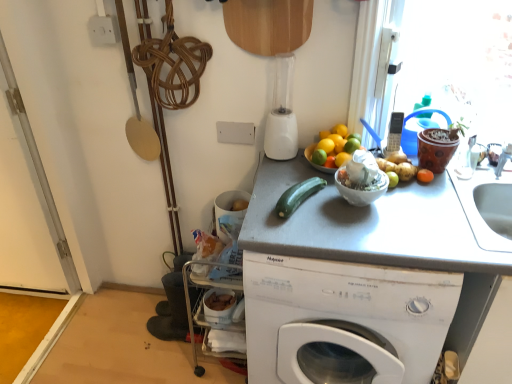
Measure the distance between point (324, 285) and camera.

Point (324, 285) and camera are 1.17 meters apart.

What is the approximate height of white plastic blender at upper center?

13.74 inches.

Identify the location of yellow matte orange at center, the 1th orange in the bottom-to-top sequence. Image resolution: width=512 pixels, height=384 pixels. (342, 158).

Measure the distance between green matte lime at center, positioned as the 1th lime in left-to-right order, and camera.

A distance of 4.72 feet exists between green matte lime at center, positioned as the 1th lime in left-to-right order, and camera.

What do you see at coordinates (361, 188) in the screenshot?
I see `white glossy bowl at center` at bounding box center [361, 188].

Locate an element on the screen. This screenshot has height=384, width=512. gray matte counter top at center is located at coordinates (366, 224).

The image size is (512, 384). What do you see at coordinates (366, 224) in the screenshot?
I see `gray matte counter top at center` at bounding box center [366, 224].

Where is `white matte washing machine at center`? This screenshot has width=512, height=384. white matte washing machine at center is located at coordinates (344, 320).

Is point (420, 176) in front of point (346, 142)?

Yes, point (420, 176) is closer to viewer.

Between orange matte at right and green matte lime at upper right, the 1th lime in the right-to-left sequence, which one appears on the left side from the viewer's perspective?

green matte lime at upper right, the 1th lime in the right-to-left sequence.

Which of these two, orange matte at right or green matte lime at upper right, which is the second lime from left to right, stands taller?

With more height is green matte lime at upper right, which is the second lime from left to right.

Is orange matte at right completely or partially outside of green matte lime at upper right, the 1th lime in the right-to-left sequence?

orange matte at right is positioned outside green matte lime at upper right, the 1th lime in the right-to-left sequence.

Is orange matte at upper right, which is the second orange from bottom to top, looking in the opposite direction of white plastic phone at upper right?

No, orange matte at upper right, which is the second orange from bottom to top, is not facing away from white plastic phone at upper right.

From the image's perspective, is orange matte at upper right, the 2th orange viewed from the top, positioned above or below white plastic phone at upper right?

Clearly, from the image's perspective, orange matte at upper right, the 2th orange viewed from the top, is below white plastic phone at upper right.

Considering the points (331, 137) and (398, 114), which point is behind, point (331, 137) or point (398, 114)?

The point (398, 114) is more distant.

From the picture: Is orange matte at upper right, which is the second orange from bottom to top, bigger than white plastic phone at upper right?

No, orange matte at upper right, which is the second orange from bottom to top, is not bigger than white plastic phone at upper right.

Are white plastic blender at upper center and orange matte at upper right, which is the second orange from bottom to top, making contact?

They are not placed beside each other.

Is white plastic blender at upper center inside or outside of orange matte at upper right, the 2th orange viewed from the top?

white plastic blender at upper center exists outside the volume of orange matte at upper right, the 2th orange viewed from the top.

Consider the image. How different are the orientations of white plastic blender at upper center and orange matte at upper right, which is the second orange from bottom to top, in degrees?

0.878 degrees separate the facing orientations of white plastic blender at upper center and orange matte at upper right, which is the second orange from bottom to top.

Considering the sizes of white plastic blender at upper center and orange matte at upper right, the 2th orange viewed from the top, in the image, is white plastic blender at upper center bigger or smaller than orange matte at upper right, the 2th orange viewed from the top,?

In the image, white plastic blender at upper center appears to be larger than orange matte at upper right, the 2th orange viewed from the top.

Which of these two, green matte lime at center, positioned as the 1th lime in left-to-right order, or white matte washing machine at center, is thinner?

green matte lime at center, positioned as the 1th lime in left-to-right order, is thinner.

Is green matte lime at center, placed as the second lime when sorted from right to left, to the right of white matte washing machine at center from the viewer's perspective?

Result: No.

Considering the positions of objects green matte lime at center, placed as the second lime when sorted from right to left, and white matte washing machine at center in the image provided, who is behind, green matte lime at center, placed as the second lime when sorted from right to left, or white matte washing machine at center?

green matte lime at center, placed as the second lime when sorted from right to left, is behind.

Is green matte lime at center, positioned as the 1th lime in left-to-right order, not inside white matte washing machine at center?

Yes, green matte lime at center, positioned as the 1th lime in left-to-right order, is located beyond the bounds of white matte washing machine at center.

Is white plastic blender at upper center surrounding orange matte at upper center, marked as the third orange in a bottom-to-top arrangement?

No, orange matte at upper center, marked as the third orange in a bottom-to-top arrangement, is not inside white plastic blender at upper center.

Considering the points (283, 101) and (326, 140), which point is in front, point (283, 101) or point (326, 140)?

The point (326, 140) is in front.

At what (x,y) coordinates should I click in order to perform the action: click on blender on the left of the orange matte at upper center, which is counted as the 1th orange, starting from the top. Please return your answer as a coordinate pair (x, y). The height and width of the screenshot is (384, 512). Looking at the image, I should click on (282, 113).

Considering the relative positions of white plastic blender at upper center and orange matte at upper center, which is counted as the 1th orange, starting from the top, in the image provided, is white plastic blender at upper center to the left of orange matte at upper center, which is counted as the 1th orange, starting from the top, from the viewer's perspective?

Yes.

Does white plastic phone at upper right have a greater width compared to green matte lime at upper right, which is the second lime from left to right?

Correct, the width of white plastic phone at upper right exceeds that of green matte lime at upper right, which is the second lime from left to right.

From the image's perspective, between white plastic phone at upper right and green matte lime at upper right, the 1th lime in the right-to-left sequence, who is located below?

green matte lime at upper right, the 1th lime in the right-to-left sequence, from the image's perspective.

Measure the distance between white plastic phone at upper right and green matte lime at upper right, which is the second lime from left to right.

6.40 inches.

Is green matte lime at upper right, the 1th lime in the right-to-left sequence, at the back of white plastic phone at upper right?

No.

From the image's perspective, which is below, white matte washing machine at center or orange matte at upper right, the 2th orange viewed from the top?

white matte washing machine at center appears lower in the image.

In order to click on the 3rd orange behind the white matte washing machine at center in this screenshot , I will do `click(337, 142)`.

Is white matte washing machine at center spatially inside orange matte at upper right, which is the second orange from bottom to top, or outside of it?

white matte washing machine at center is not inside orange matte at upper right, which is the second orange from bottom to top, it's outside.

The image size is (512, 384). There is a orange matte at right. In order to click on the 2nd lime above it (from a real-world perspective) in this screenshot , I will do coord(351,145).

You are a GUI agent. You are given a task and a screenshot of the screen. Output one action in this format:
    pyautogui.click(x=<x>, y=<y>)
    Task: Click on the orange that is the 1st object located in front of the white plastic phone at upper right
    
    Given the screenshot: What is the action you would take?
    pyautogui.click(x=337, y=142)

When comparing their distances from orange matte at right, does green matte lime at center, placed as the second lime when sorted from right to left, or orange matte at upper center, marked as the third orange in a bottom-to-top arrangement, seem further?

green matte lime at center, placed as the second lime when sorted from right to left, is positioned further to the anchor orange matte at right.

Looking at the image, which one is located closer to white glossy bowl at center, white matte washing machine at center or yellow matte orange at center, which is the third orange from top to bottom?

yellow matte orange at center, which is the third orange from top to bottom, lies closer to white glossy bowl at center than the other object.

When comparing their distances from green matte lime at center, placed as the second lime when sorted from right to left, does orange matte at upper center, which is counted as the 1th orange, starting from the top, or white matte washing machine at center seem closer?

orange matte at upper center, which is counted as the 1th orange, starting from the top, lies closer to green matte lime at center, placed as the second lime when sorted from right to left, than the other object.

From the image, which object appears to be nearer to green matte lime at upper right, the 1th lime in the right-to-left sequence, orange matte at right or green smooth-textured zucchini at center?

Based on the image, orange matte at right appears to be nearer to green matte lime at upper right, the 1th lime in the right-to-left sequence.

From the image, which object appears to be farther from orange matte at right, white plastic phone at upper right or green matte lime at center, placed as the second lime when sorted from right to left?

Among the two, green matte lime at center, placed as the second lime when sorted from right to left, is located further to orange matte at right.

Looking at the image, which one is located further to white matte washing machine at center, yellow matte orange at center, which is the third orange from top to bottom, or orange matte at upper right, the 2th orange viewed from the top?

orange matte at upper right, the 2th orange viewed from the top, lies further to white matte washing machine at center than the other object.

From the image, which object appears to be nearer to white plastic blender at upper center, orange matte at upper right, which is the second orange from bottom to top, or green smooth-textured zucchini at center?

Based on the image, orange matte at upper right, which is the second orange from bottom to top, appears to be nearer to white plastic blender at upper center.

Which object lies nearer to the anchor point white plastic blender at upper center, green matte lime at center, placed as the second lime when sorted from right to left, or gray matte counter top at center?

Among the two, green matte lime at center, placed as the second lime when sorted from right to left, is located nearer to white plastic blender at upper center.

I want to click on basin between yellow matte orange at center, the 1th orange in the bottom-to-top sequence, and gray matte counter top at center in the up-down direction, so click(361, 188).

I want to click on orange between orange matte at upper right, which is the second orange from bottom to top, and gray matte counter top at center, in the vertical direction, so click(342, 158).

The height and width of the screenshot is (384, 512). Find the location of `appliance located between orange matte at upper center, which is counted as the 1th orange, starting from the top, and orange matte at right in the left-right direction`. appliance located between orange matte at upper center, which is counted as the 1th orange, starting from the top, and orange matte at right in the left-right direction is located at coordinates (394, 133).

In order to click on appliance between yellow matte orange at center, the 1th orange in the bottom-to-top sequence, and orange matte at right, in the horizontal direction in this screenshot , I will do `click(394, 133)`.